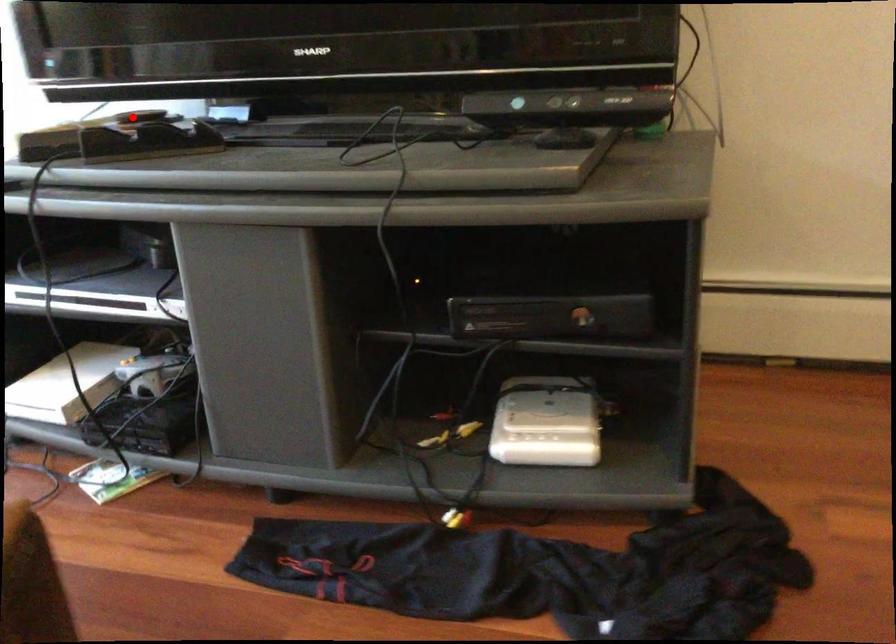
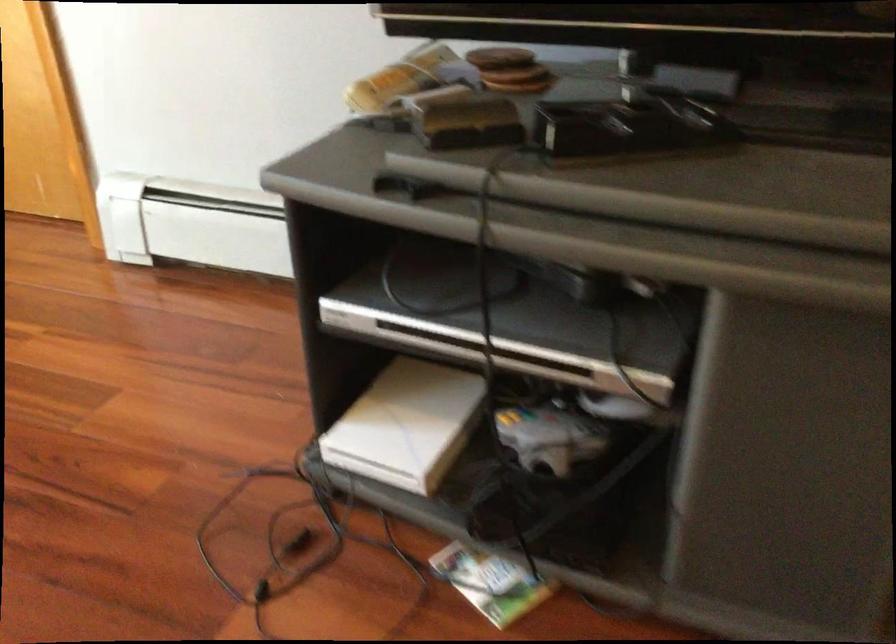
Question: I am providing you with two images of the same scene from different viewpoints. Given a red point in image1, look at the same physical point in image2. Is it:

Choices:
 (A) Closer to the viewpoint
 (B) Farther from the viewpoint

Answer: (A)